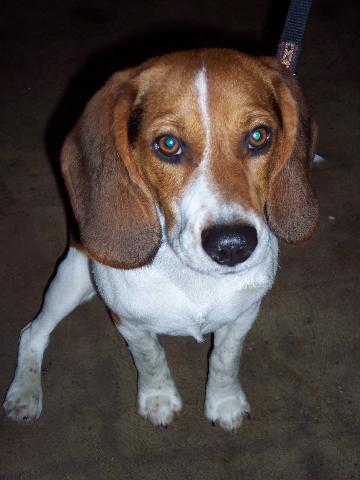
The image size is (360, 480). I want to click on green in carpet, so click(x=299, y=421), click(x=79, y=442), click(x=191, y=428), click(x=318, y=342).